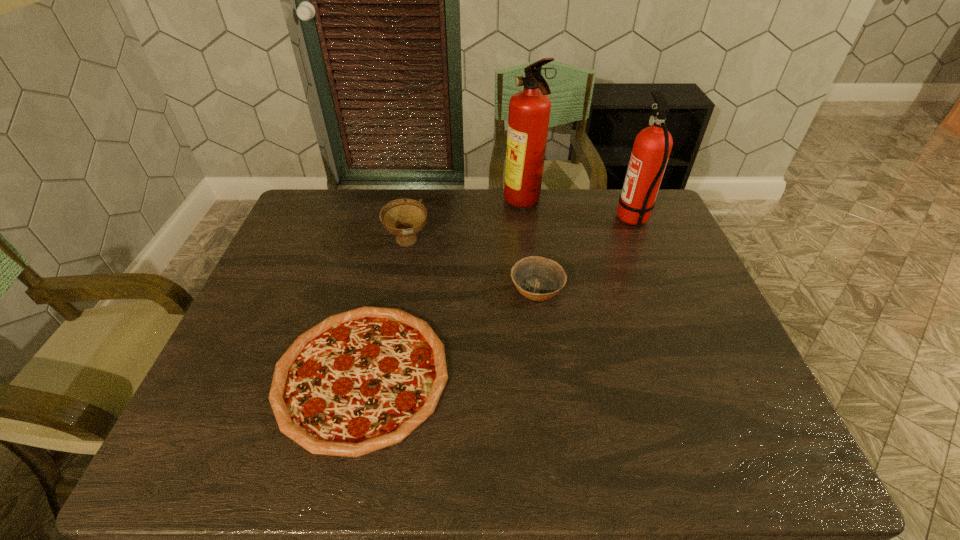
I want to click on the tallest object, so click(529, 110).

Locate an element on the screen. The image size is (960, 540). the taller fire extinguisher is located at coordinates click(x=529, y=110).

Identify the location of the right fire extinguisher. (652, 146).

Find the location of a particular element. This screenshot has width=960, height=540. the rightmost object is located at coordinates (652, 146).

Find the location of a particular element. The image size is (960, 540). the third tallest object is located at coordinates (x=404, y=218).

Where is `the second nearest object`? the second nearest object is located at coordinates (537, 278).

This screenshot has width=960, height=540. Identify the location of bowl. (537, 278).

Find the location of a particular element. This screenshot has width=960, height=540. pizza is located at coordinates (362, 380).

Where is `the nearest object`? the nearest object is located at coordinates (362, 380).

Find the location of a particular element. free space located on the front-facing side of the left fire extinguisher is located at coordinates (484, 203).